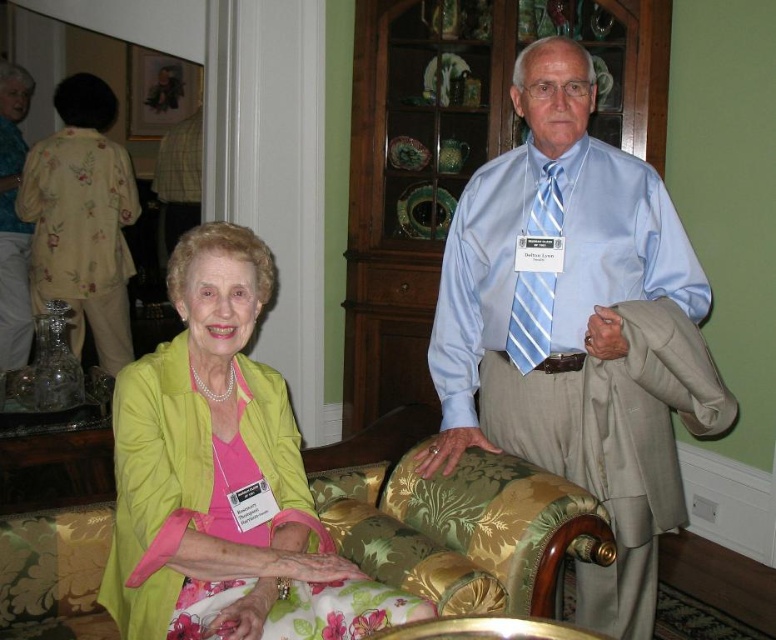
Is light blue satin shirt at upper center taller than light blue striped tie at center?

Yes.

Is point (577, 179) more distant than point (539, 340)?

Yes, point (577, 179) is behind point (539, 340).

This screenshot has width=776, height=640. What are the coordinates of `light blue satin shirt at upper center` in the screenshot? It's located at click(x=577, y=328).

Is light blue satin shirt at upper center positioned behind gold floral fabric couch at center?

Yes, it is behind gold floral fabric couch at center.

Which is below, light blue satin shirt at upper center or gold floral fabric couch at center?

Positioned lower is gold floral fabric couch at center.

Find the location of a particular element. light blue satin shirt at upper center is located at coordinates (577, 328).

Between light blue satin shirt at upper center and green fabric dress at lower left, which one has less height?

With less height is green fabric dress at lower left.

Between light blue satin shirt at upper center and green fabric dress at lower left, which one is positioned lower?

green fabric dress at lower left is below.

You are a GUI agent. You are given a task and a screenshot of the screen. Output one action in this format:
    pyautogui.click(x=<x>, y=<y>)
    Task: Click on the light blue satin shirt at upper center
    
    Given the screenshot: What is the action you would take?
    pyautogui.click(x=577, y=328)

Locate an element on the screen. light blue satin shirt at upper center is located at coordinates (577, 328).